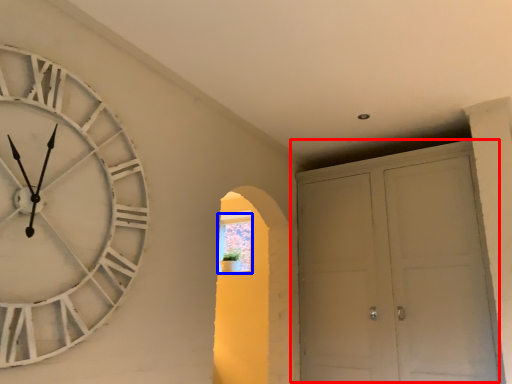
Question: Which point is further to the camera, door (highlighted by a red box) or window (highlighted by a blue box)?

Choices:
 (A) door
 (B) window

Answer: (B)